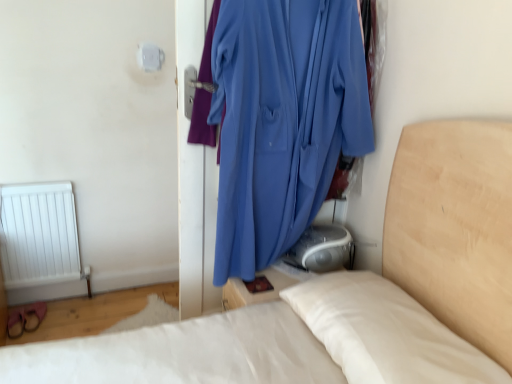
Question: Can you confirm if smooth white bed at center is taller than blue fabric at center?

Choices:
 (A) yes
 (B) no

Answer: (B)

Question: Does smooth white bed at center appear on the left side of blue fabric at center?

Choices:
 (A) no
 (B) yes

Answer: (B)

Question: From the image's perspective, is smooth white bed at center beneath blue fabric at center?

Choices:
 (A) no
 (B) yes

Answer: (B)

Question: Is blue fabric at center inside smooth white bed at center?

Choices:
 (A) no
 (B) yes

Answer: (A)

Question: Are smooth white bed at center and blue fabric at center far apart?

Choices:
 (A) no
 (B) yes

Answer: (A)

Question: Does smooth white bed at center have a lesser height compared to blue fabric at center?

Choices:
 (A) no
 (B) yes

Answer: (B)

Question: Is blue fabric at center at the right side of smooth white bed at center?

Choices:
 (A) yes
 (B) no

Answer: (A)

Question: Does blue fabric at center lie behind smooth white bed at center?

Choices:
 (A) yes
 (B) no

Answer: (A)

Question: Is blue fabric at center surrounding smooth white bed at center?

Choices:
 (A) yes
 (B) no

Answer: (B)

Question: From a real-world perspective, does blue fabric at center sit lower than smooth white bed at center?

Choices:
 (A) no
 (B) yes

Answer: (A)

Question: Would you consider blue fabric at center to be distant from smooth white bed at center?

Choices:
 (A) no
 (B) yes

Answer: (A)

Question: Does blue fabric at center have a greater height compared to smooth white bed at center?

Choices:
 (A) yes
 (B) no

Answer: (A)

Question: Does point (497, 238) appear closer or farther from the camera than point (223, 173)?

Choices:
 (A) closer
 (B) farther

Answer: (A)